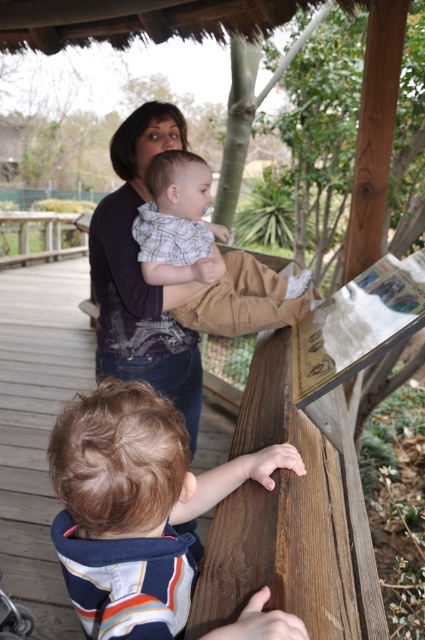
Question: Which point is farther to the camera?

Choices:
 (A) (107, 333)
 (B) (13, 628)
 (C) (105, 557)
 (D) (167, 236)

Answer: (A)

Question: Which point is farther from the camera taking this photo?

Choices:
 (A) (11, 634)
 (B) (176, 316)
 (C) (173, 138)

Answer: (C)

Question: Is matte black shirt at upper center positioned before light brown cotton pants at upper center?

Choices:
 (A) yes
 (B) no

Answer: (B)

Question: Can you confirm if brown textured hair at upper center is positioned to the right of light brown cotton pants at upper center?

Choices:
 (A) yes
 (B) no

Answer: (B)

Question: Which of the following is the farthest from the observer?

Choices:
 (A) (221, 332)
 (B) (104, 268)
 (C) (27, 632)
 (D) (102, 611)

Answer: (C)

Question: Is brown textured hair at upper center further to the viewer compared to light brown cotton pants at upper center?

Choices:
 (A) yes
 (B) no

Answer: (B)